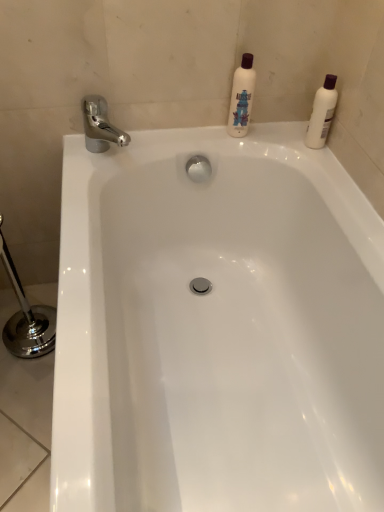
What is the approximate height of white matte bottle at upper center, which is the 1th cleaning product in left-to-right order?

8.92 inches.

Image resolution: width=384 pixels, height=512 pixels. What are the coordinates of `chrome metallic faucet at upper left` in the screenshot? It's located at (100, 126).

Identify the location of white glossy bathtub at center. (217, 328).

This screenshot has height=512, width=384. I want to click on white plastic bottle at upper right, positioned as the 1th cleaning product in right-to-left order, so click(322, 113).

Relative to white plastic bottle at upper right, positioned as the 1th cleaning product in right-to-left order, is chrome metallic faucet at upper left in front or behind?

chrome metallic faucet at upper left is positioned closer to the viewer than white plastic bottle at upper right, positioned as the 1th cleaning product in right-to-left order.

In terms of size, does chrome metallic faucet at upper left appear bigger or smaller than white plastic bottle at upper right, which is the 2th cleaning product from left to right?

chrome metallic faucet at upper left is bigger than white plastic bottle at upper right, which is the 2th cleaning product from left to right.

From the picture: From the image's perspective, is chrome metallic faucet at upper left on top of white plastic bottle at upper right, positioned as the 1th cleaning product in right-to-left order?

Incorrect, from the image's perspective, chrome metallic faucet at upper left is lower than white plastic bottle at upper right, positioned as the 1th cleaning product in right-to-left order.

Considering the relative sizes of chrome metallic faucet at upper left and white plastic bottle at upper right, which is the 2th cleaning product from left to right, in the image provided, is chrome metallic faucet at upper left thinner than white plastic bottle at upper right, which is the 2th cleaning product from left to right,?

No, chrome metallic faucet at upper left is not thinner than white plastic bottle at upper right, which is the 2th cleaning product from left to right.

Which of these two, white plastic bottle at upper right, which is the 2th cleaning product from left to right, or white glossy bathtub at center, is bigger?

With larger size is white glossy bathtub at center.

In the image, is white plastic bottle at upper right, which is the 2th cleaning product from left to right, positioned in front of or behind white glossy bathtub at center?

Visually, white plastic bottle at upper right, which is the 2th cleaning product from left to right, is located behind white glossy bathtub at center.

Is white plastic bottle at upper right, positioned as the 1th cleaning product in right-to-left order, situated inside white glossy bathtub at center or outside?

white plastic bottle at upper right, positioned as the 1th cleaning product in right-to-left order, cannot be found inside white glossy bathtub at center.

What's the angular difference between white plastic bottle at upper right, which is the 2th cleaning product from left to right, and white glossy bathtub at center's facing directions?

The facing directions of white plastic bottle at upper right, which is the 2th cleaning product from left to right, and white glossy bathtub at center are 4.19 degrees apart.

Is there a large distance between white matte bottle at upper center, which is the 2th cleaning product in right-to-left order, and white glossy bathtub at center?

Actually, white matte bottle at upper center, which is the 2th cleaning product in right-to-left order, and white glossy bathtub at center are a little close together.

Is white matte bottle at upper center, which is the 2th cleaning product in right-to-left order, to the right of white glossy bathtub at center from the viewer's perspective?

Correct, you'll find white matte bottle at upper center, which is the 2th cleaning product in right-to-left order, to the right of white glossy bathtub at center.

Identify the location of bathtub to the left of white matte bottle at upper center, which is the 2th cleaning product in right-to-left order. (217, 328).

Which of these two, white matte bottle at upper center, which is the 1th cleaning product in left-to-right order, or white glossy bathtub at center, is bigger?

Bigger between the two is white glossy bathtub at center.

Based on the photo, is chrome metallic faucet at upper left wider than white matte bottle at upper center, which is the 1th cleaning product in left-to-right order?

Correct, the width of chrome metallic faucet at upper left exceeds that of white matte bottle at upper center, which is the 1th cleaning product in left-to-right order.

From a real-world perspective, which is physically below, chrome metallic faucet at upper left or white matte bottle at upper center, which is the 1th cleaning product in left-to-right order?

chrome metallic faucet at upper left.

This screenshot has width=384, height=512. Find the location of `cleaning product that is the 1st object to the right of the chrome metallic faucet at upper left, starting at the anchor`. cleaning product that is the 1st object to the right of the chrome metallic faucet at upper left, starting at the anchor is located at coordinates (241, 97).

Is white matte bottle at upper center, which is the 1th cleaning product in left-to-right order, inside chrome metallic faucet at upper left?

No, white matte bottle at upper center, which is the 1th cleaning product in left-to-right order, is located outside of chrome metallic faucet at upper left.

Is white matte bottle at upper center, which is the 1th cleaning product in left-to-right order, facing towards white plastic bottle at upper right, which is the 2th cleaning product from left to right?

No, white matte bottle at upper center, which is the 1th cleaning product in left-to-right order, is not turned towards white plastic bottle at upper right, which is the 2th cleaning product from left to right.

Which of these two, white matte bottle at upper center, which is the 2th cleaning product in right-to-left order, or white plastic bottle at upper right, positioned as the 1th cleaning product in right-to-left order, is bigger?

Bigger between the two is white matte bottle at upper center, which is the 2th cleaning product in right-to-left order.

From a real-world perspective, is white matte bottle at upper center, which is the 2th cleaning product in right-to-left order, beneath white plastic bottle at upper right, positioned as the 1th cleaning product in right-to-left order?

Incorrect, from a real-world perspective, white matte bottle at upper center, which is the 2th cleaning product in right-to-left order, is higher than white plastic bottle at upper right, positioned as the 1th cleaning product in right-to-left order.

Is white matte bottle at upper center, which is the 1th cleaning product in left-to-right order, closer to the viewer compared to white plastic bottle at upper right, positioned as the 1th cleaning product in right-to-left order?

No, the depth of white matte bottle at upper center, which is the 1th cleaning product in left-to-right order, is greater than that of white plastic bottle at upper right, positioned as the 1th cleaning product in right-to-left order.

From a real-world perspective, which is physically above, white plastic bottle at upper right, positioned as the 1th cleaning product in right-to-left order, or white matte bottle at upper center, which is the 1th cleaning product in left-to-right order?

white matte bottle at upper center, which is the 1th cleaning product in left-to-right order, is physically above.

From the image's perspective, which one is positioned lower, white plastic bottle at upper right, which is the 2th cleaning product from left to right, or white matte bottle at upper center, which is the 1th cleaning product in left-to-right order?

white plastic bottle at upper right, which is the 2th cleaning product from left to right, appears lower in the image.

Does white plastic bottle at upper right, positioned as the 1th cleaning product in right-to-left order, appear on the right side of white matte bottle at upper center, which is the 1th cleaning product in left-to-right order?

Yes.

Would you say chrome metallic faucet at upper left is inside or outside white glossy bathtub at center?

chrome metallic faucet at upper left is outside white glossy bathtub at center.

Does point (87, 119) come farther from viewer compared to point (138, 243)?

No.

Which of these two, chrome metallic faucet at upper left or white glossy bathtub at center, stands shorter?

chrome metallic faucet at upper left.

Where is `tap in front of the white plastic bottle at upper right, which is the 2th cleaning product from left to right`? The width and height of the screenshot is (384, 512). tap in front of the white plastic bottle at upper right, which is the 2th cleaning product from left to right is located at coordinates coord(100,126).

Locate an element on the screen. cleaning product that is the 2nd one when counting rightward from the white glossy bathtub at center is located at coordinates (322, 113).

Looking at the image, which one is located further to chrome metallic faucet at upper left, white glossy bathtub at center or white matte bottle at upper center, which is the 2th cleaning product in right-to-left order?

Among the two, white glossy bathtub at center is located further to chrome metallic faucet at upper left.

Based on their spatial positions, is white glossy bathtub at center or white matte bottle at upper center, which is the 2th cleaning product in right-to-left order, closer to white plastic bottle at upper right, positioned as the 1th cleaning product in right-to-left order?

white matte bottle at upper center, which is the 2th cleaning product in right-to-left order, is closer to white plastic bottle at upper right, positioned as the 1th cleaning product in right-to-left order.

Considering their positions, is chrome metallic faucet at upper left positioned further to white matte bottle at upper center, which is the 1th cleaning product in left-to-right order, than white plastic bottle at upper right, which is the 2th cleaning product from left to right?

chrome metallic faucet at upper left is further to white matte bottle at upper center, which is the 1th cleaning product in left-to-right order.

When comparing their distances from chrome metallic faucet at upper left, does white plastic bottle at upper right, which is the 2th cleaning product from left to right, or white matte bottle at upper center, which is the 1th cleaning product in left-to-right order, seem closer?

Among the two, white matte bottle at upper center, which is the 1th cleaning product in left-to-right order, is located nearer to chrome metallic faucet at upper left.

Looking at the image, which one is located closer to white matte bottle at upper center, which is the 2th cleaning product in right-to-left order, white plastic bottle at upper right, positioned as the 1th cleaning product in right-to-left order, or chrome metallic faucet at upper left?

white plastic bottle at upper right, positioned as the 1th cleaning product in right-to-left order, is closer to white matte bottle at upper center, which is the 2th cleaning product in right-to-left order.

Looking at the image, which one is located closer to white glossy bathtub at center, white matte bottle at upper center, which is the 2th cleaning product in right-to-left order, or white plastic bottle at upper right, positioned as the 1th cleaning product in right-to-left order?

white matte bottle at upper center, which is the 2th cleaning product in right-to-left order, lies closer to white glossy bathtub at center than the other object.

When comparing their distances from chrome metallic faucet at upper left, does white matte bottle at upper center, which is the 2th cleaning product in right-to-left order, or white plastic bottle at upper right, which is the 2th cleaning product from left to right, seem closer?

white matte bottle at upper center, which is the 2th cleaning product in right-to-left order, lies closer to chrome metallic faucet at upper left than the other object.

Which object lies nearer to the anchor point white glossy bathtub at center, chrome metallic faucet at upper left or white plastic bottle at upper right, positioned as the 1th cleaning product in right-to-left order?

Based on the image, chrome metallic faucet at upper left appears to be nearer to white glossy bathtub at center.

Identify the location of cleaning product located between chrome metallic faucet at upper left and white plastic bottle at upper right, positioned as the 1th cleaning product in right-to-left order, in the left-right direction. (241, 97).

You are a GUI agent. You are given a task and a screenshot of the screen. Output one action in this format:
    pyautogui.click(x=<x>, y=<y>)
    Task: Click on the cleaning product between white matte bottle at upper center, which is the 2th cleaning product in right-to-left order, and white glossy bathtub at center, in the vertical direction
    
    Given the screenshot: What is the action you would take?
    pyautogui.click(x=322, y=113)

Locate an element on the screen. The height and width of the screenshot is (512, 384). tap between white matte bottle at upper center, which is the 2th cleaning product in right-to-left order, and white glossy bathtub at center in the up-down direction is located at coordinates (100, 126).

Where is `tap between white plastic bottle at upper right, positioned as the 1th cleaning product in right-to-left order, and white glossy bathtub at center from top to bottom`? Image resolution: width=384 pixels, height=512 pixels. tap between white plastic bottle at upper right, positioned as the 1th cleaning product in right-to-left order, and white glossy bathtub at center from top to bottom is located at coordinates (100, 126).